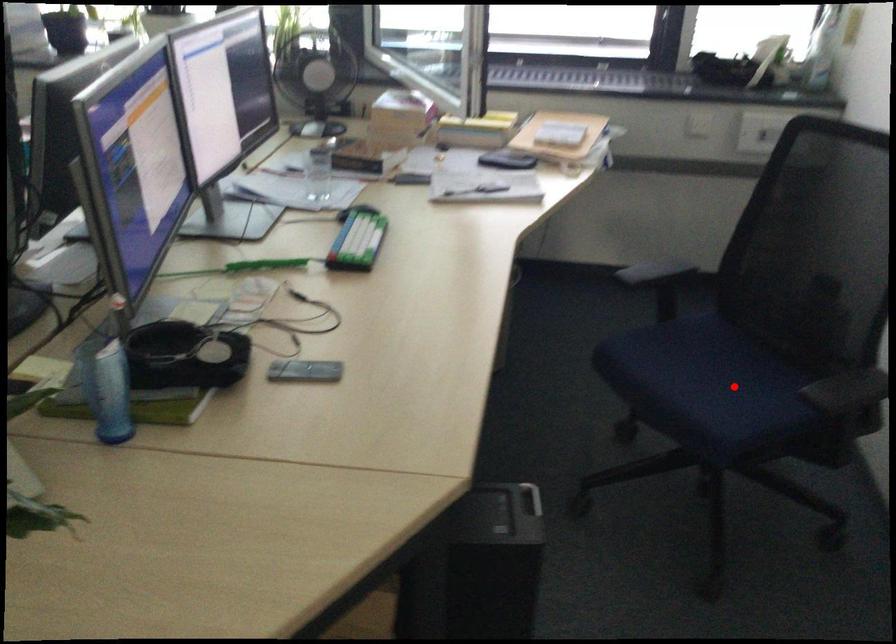
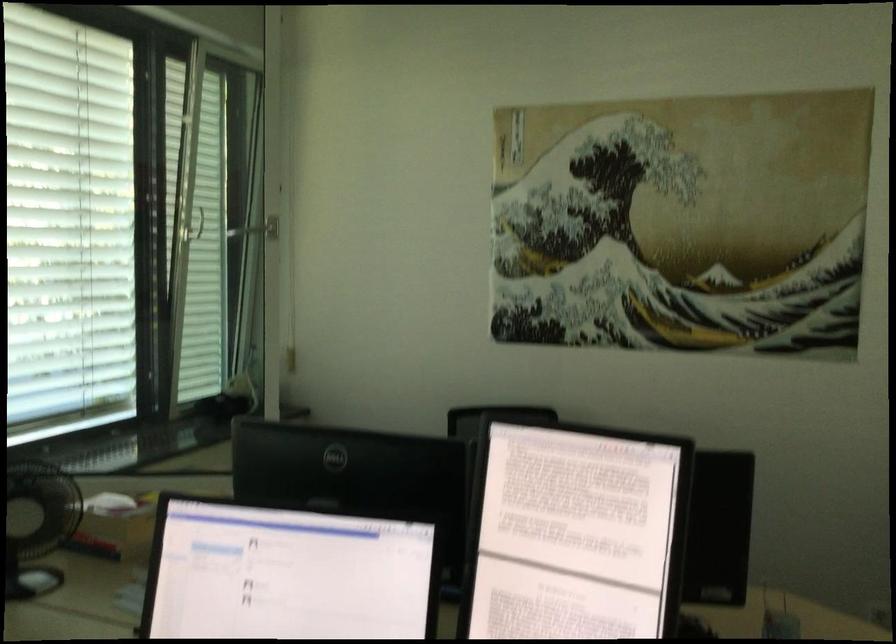
Question: I am providing you with two images of the same scene from different viewpoints. A red point is marked on the first image. Is the red point's position out of view in image 2?

Choices:
 (A) Yes
 (B) No

Answer: (A)